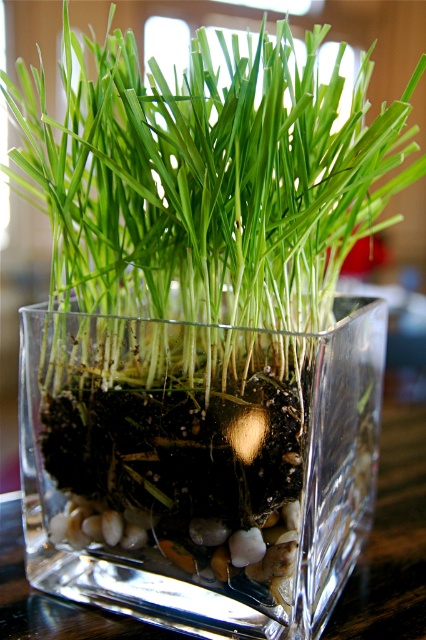
You are a gardener trying to plant a new flower in the transparent glass cube at center. The flower requires a minimum of 4 inches of space between the soil surface and the glass cube wall to grow properly. Based on the image, will the green matte grass at center interfere with the flower growth?

The distance between the transparent glass cube at center and the green matte grass at center is 3.54 inches, which is less than the required 4 inches. Therefore, the green matte grass at center may interfere with the flower growth as there isn not enough space.

You have a small toy car that is 10 cm long. You want to place it inside the transparent glass cube at center without it touching the green matte grass at center. Is this possible?

The transparent glass cube at center has a smaller width than the green matte grass at center. Since the grass is wider, it might occupy more space inside the cube, making it difficult to place the toy car without touching it. However, the exact positioning would depend on how the grass is arranged. If the grass is spread out, there might be space, but if it is clustered, it could block the car. Without more details, it is uncertain.